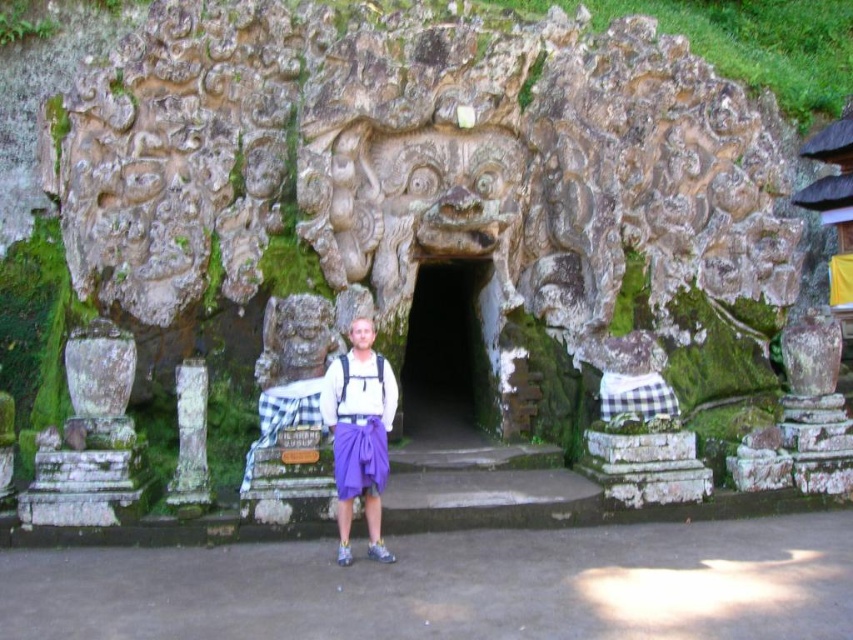
Describe the element at coordinates (358, 433) in the screenshot. This screenshot has width=853, height=640. I see `purple cotton sarong at center` at that location.

Is point (340, 476) more distant than point (200, 483)?

No.

Identify the location of purple cotton sarong at center. This screenshot has height=640, width=853. (358, 433).

Locate an element on the screen. Image resolution: width=853 pixels, height=640 pixels. purple cotton sarong at center is located at coordinates (358, 433).

Is dark stone cave at center to the left of purple fabric apron at center from the viewer's perspective?

No, dark stone cave at center is not to the left of purple fabric apron at center.

Which is below, dark stone cave at center or purple fabric apron at center?

purple fabric apron at center is lower down.

Describe the element at coordinates (447, 353) in the screenshot. I see `dark stone cave at center` at that location.

The image size is (853, 640). I want to click on dark stone cave at center, so click(x=447, y=353).

Which is behind, point (370, 470) or point (337, 416)?

The point (337, 416) is behind.

Does purple cotton sarong at center have a greater height compared to purple fabric apron at center?

Incorrect, purple cotton sarong at center's height is not larger of purple fabric apron at center's.

Which is in front, point (337, 470) or point (351, 416)?

Positioned in front is point (337, 470).

Find the location of a particular element. purple cotton sarong at center is located at coordinates (358, 433).